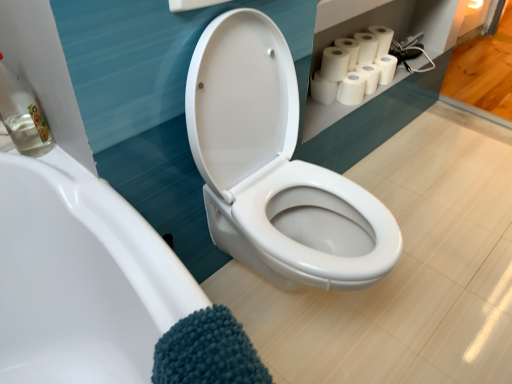
Question: Does white matte toilet paper at upper right, the first toilet paper viewed from the left, have a greater width compared to white matte toilet paper at upper right, placed as the third toilet paper when sorted from left to right?

Choices:
 (A) yes
 (B) no

Answer: (A)

Question: From a real-world perspective, is white matte toilet paper at upper right, placed as the 7th toilet paper when sorted from right to left, physically above white matte toilet paper at upper right, the 5th toilet paper in the right-to-left sequence?

Choices:
 (A) no
 (B) yes

Answer: (A)

Question: Is white matte toilet paper at upper right, the first toilet paper viewed from the left, taller than white matte toilet paper at upper right, the 5th toilet paper in the right-to-left sequence?

Choices:
 (A) no
 (B) yes

Answer: (A)

Question: From the image's perspective, is white matte toilet paper at upper right, placed as the 7th toilet paper when sorted from right to left, located beneath white matte toilet paper at upper right, placed as the third toilet paper when sorted from left to right?

Choices:
 (A) yes
 (B) no

Answer: (A)

Question: Is white matte toilet paper at upper right, the first toilet paper viewed from the left, smaller than white matte toilet paper at upper right, placed as the third toilet paper when sorted from left to right?

Choices:
 (A) no
 (B) yes

Answer: (B)

Question: Is white matte toilet paper at upper right, the first toilet paper viewed from the left, bigger than white matte toilet paper at upper right, the 5th toilet paper in the right-to-left sequence?

Choices:
 (A) yes
 (B) no

Answer: (B)

Question: Is white matte toilet paper at upper right, the fifth toilet paper in the left-to-right sequence, shorter than white matte toilet paper at upper right, which is the 2th toilet paper from left to right?

Choices:
 (A) yes
 (B) no

Answer: (A)

Question: Is white matte toilet paper at upper right, positioned as the sixth toilet paper in right-to-left order, located within white matte toilet paper at upper right, the fifth toilet paper in the left-to-right sequence?

Choices:
 (A) no
 (B) yes

Answer: (A)

Question: Does white matte toilet paper at upper right, the fifth toilet paper in the left-to-right sequence, touch white matte toilet paper at upper right, which is the 2th toilet paper from left to right?

Choices:
 (A) yes
 (B) no

Answer: (B)

Question: Can you confirm if white matte toilet paper at upper right, the 3th toilet paper when ordered from right to left, is wider than white matte toilet paper at upper right, positioned as the sixth toilet paper in right-to-left order?

Choices:
 (A) yes
 (B) no

Answer: (B)

Question: From the image's perspective, would you say white matte toilet paper at upper right, the fifth toilet paper in the left-to-right sequence, is positioned over white matte toilet paper at upper right, positioned as the sixth toilet paper in right-to-left order?

Choices:
 (A) yes
 (B) no

Answer: (B)

Question: Does white matte toilet paper at upper right, the fifth toilet paper in the left-to-right sequence, have a smaller size compared to white matte toilet paper at upper right, which is the 2th toilet paper from left to right?

Choices:
 (A) no
 (B) yes

Answer: (B)

Question: From a real-world perspective, is white matte toilet paper at upper right, the 3th toilet paper when ordered from right to left, on top of white matte toilet paper at upper right, marked as the 6th toilet paper in a left-to-right arrangement?

Choices:
 (A) no
 (B) yes

Answer: (A)